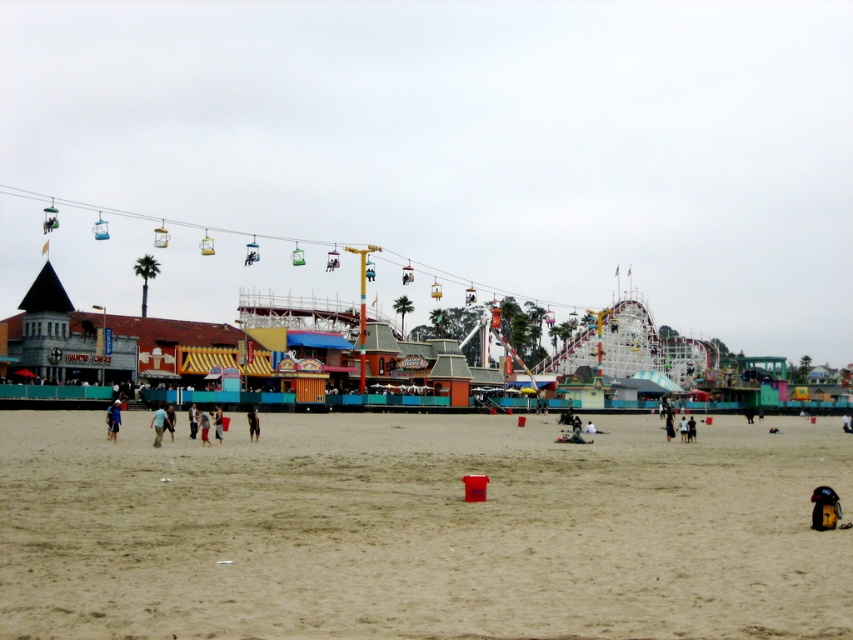
Question: Does fine-grained sand at center appear over dark blue shorts at center?

Choices:
 (A) no
 (B) yes

Answer: (A)

Question: Which of the following is the closest to the observer?

Choices:
 (A) (32, 428)
 (B) (163, 426)
 (C) (115, 397)

Answer: (B)

Question: Which object appears farthest from the camera in this image?

Choices:
 (A) dark blue shorts at center
 (B) dark blue jeans at center
 (C) blue denim shorts at lower left

Answer: (A)

Question: Does fine-grained sand at center lie in front of dark blue jeans at center?

Choices:
 (A) yes
 (B) no

Answer: (A)

Question: Which object appears farthest from the camera in this image?

Choices:
 (A) dark blue shorts at center
 (B) blue denim shorts at lower left
 (C) fine-grained sand at center
 (D) dark blue jeans at center

Answer: (A)

Question: Is dark blue jeans at center positioned before dark blue shorts at center?

Choices:
 (A) yes
 (B) no

Answer: (A)